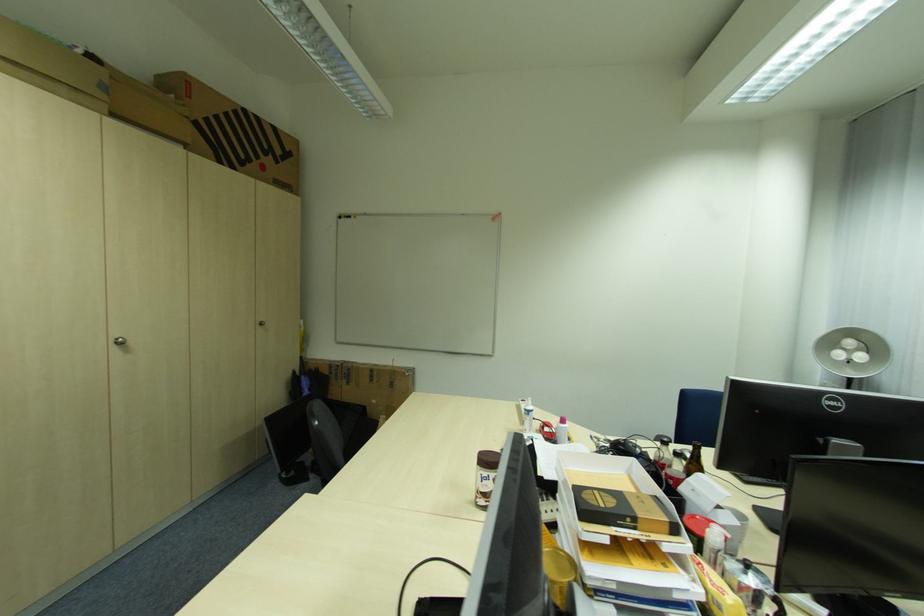
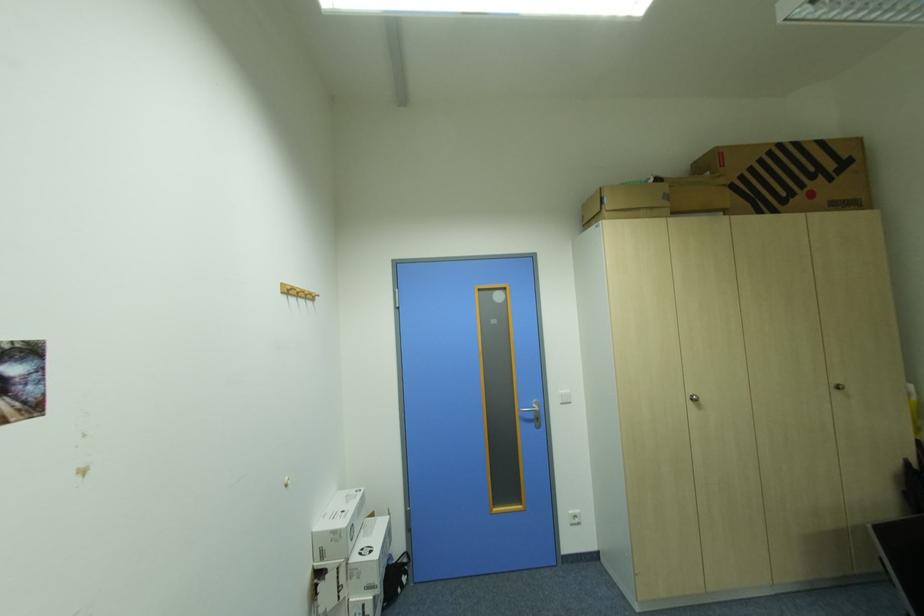
Where in the second image is the point corresponding to (x=119, y=342) from the first image?

(697, 399)